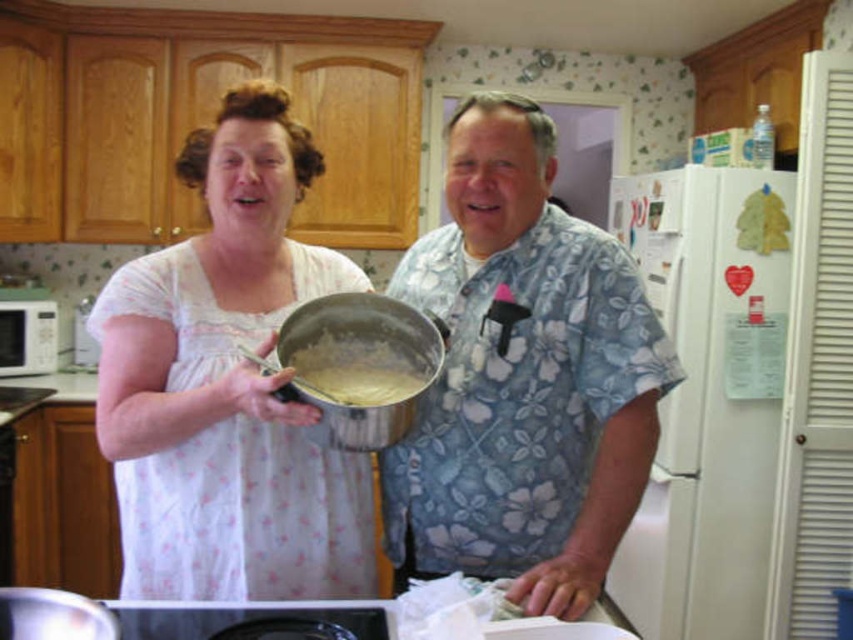
Question: Is blue floral shirt at center closer to the viewer compared to white cotton dress at center?

Choices:
 (A) no
 (B) yes

Answer: (B)

Question: Is blue floral shirt at center wider than white cotton dress at center?

Choices:
 (A) yes
 (B) no

Answer: (A)

Question: Among these objects, which one is nearest to the camera?

Choices:
 (A) white cotton dress at center
 (B) white creamy batter at center
 (C) white matte microwave at left
 (D) blue floral shirt at center

Answer: (D)

Question: Among these objects, which one is farthest from the camera?

Choices:
 (A) white creamy batter at center
 (B) white matte microwave at left
 (C) blue floral shirt at center
 (D) white cotton dress at center

Answer: (B)

Question: Which of the following is the farthest from the observer?

Choices:
 (A) white cotton dress at center
 (B) white creamy batter at center
 (C) white matte microwave at left
 (D) blue floral shirt at center

Answer: (C)

Question: Does blue floral shirt at center appear under white creamy batter at center?

Choices:
 (A) yes
 (B) no

Answer: (B)